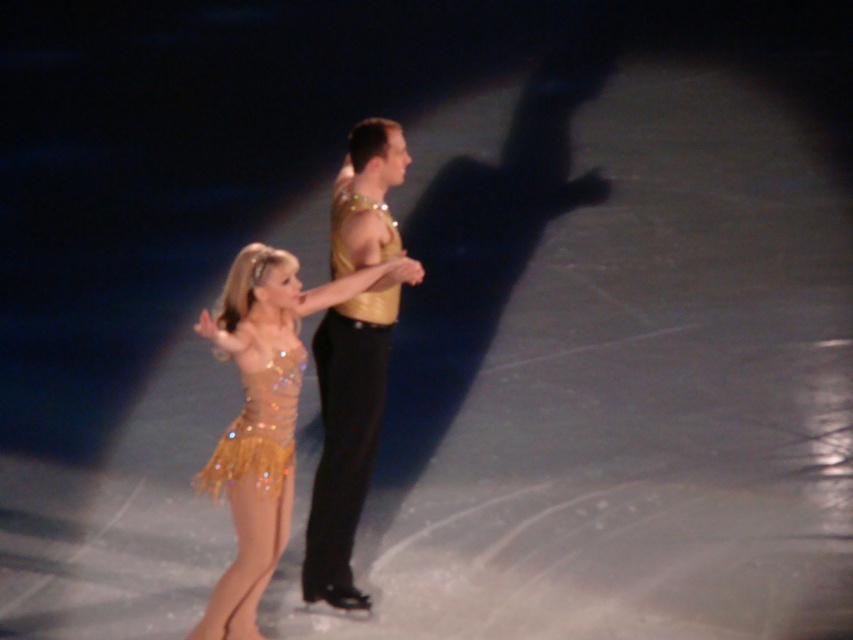
Image resolution: width=853 pixels, height=640 pixels. What do you see at coordinates (347, 432) in the screenshot?
I see `gold shiny suit at center` at bounding box center [347, 432].

Where is `gold shiny suit at center`? gold shiny suit at center is located at coordinates [x=347, y=432].

The width and height of the screenshot is (853, 640). What do you see at coordinates (347, 432) in the screenshot?
I see `gold shiny suit at center` at bounding box center [347, 432].

This screenshot has height=640, width=853. In order to click on gold shiny suit at center in this screenshot , I will do `click(347, 432)`.

Which is above, sparkly gold dress at center or gold shiny suit at center?

gold shiny suit at center

The height and width of the screenshot is (640, 853). Identify the location of sparkly gold dress at center. tap(263, 417).

Where is `sparkly gold dress at center`? Image resolution: width=853 pixels, height=640 pixels. sparkly gold dress at center is located at coordinates (263, 417).

Does sparkly gold dress at center appear on the right side of gold sequined dress at center?

No, sparkly gold dress at center is not to the right of gold sequined dress at center.

Does sparkly gold dress at center have a smaller size compared to gold sequined dress at center?

Actually, sparkly gold dress at center might be larger than gold sequined dress at center.

Between point (235, 596) and point (294, 358), which one is positioned behind?

The point (294, 358) is behind.

This screenshot has height=640, width=853. Find the location of `sparkly gold dress at center`. sparkly gold dress at center is located at coordinates (263, 417).